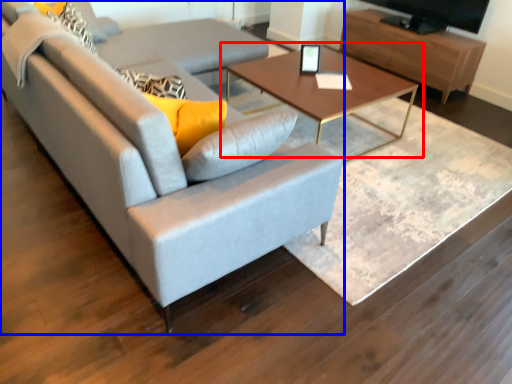
Question: Among these objects, which one is nearest to the camera, coffee table (highlighted by a red box) or studio couch (highlighted by a blue box)?

Choices:
 (A) coffee table
 (B) studio couch

Answer: (B)